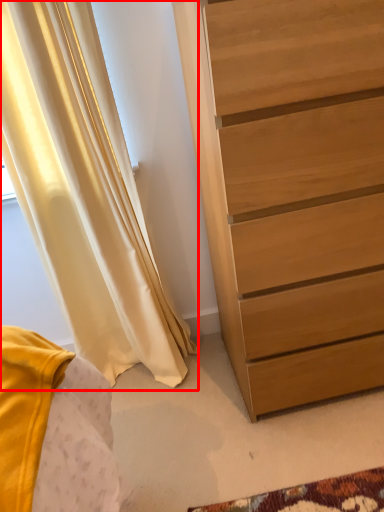
Question: Considering the relative positions of curtain (annotated by the red box) and chest of drawers in the image provided, where is curtain (annotated by the red box) located with respect to the staircase?

Choices:
 (A) left
 (B) right

Answer: (A)